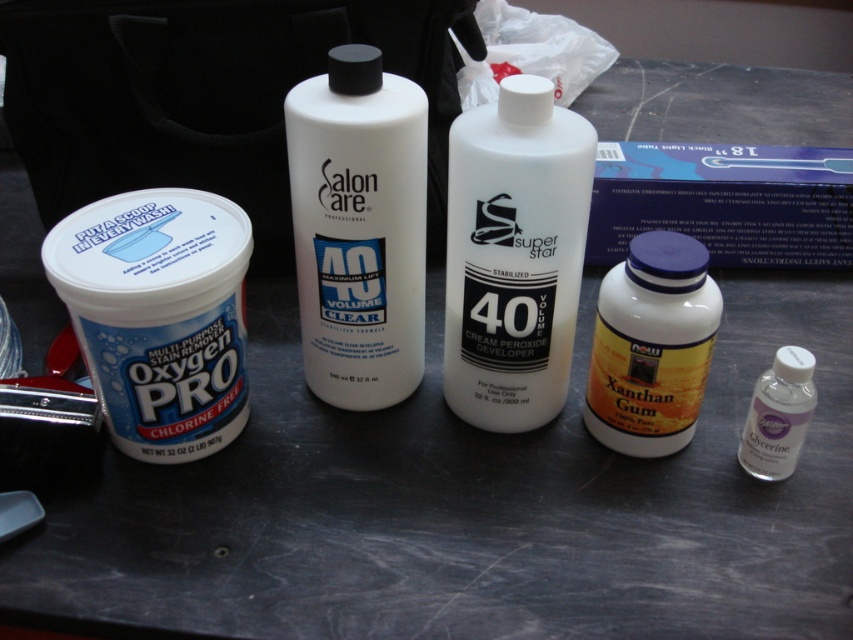
Which is above, white matte container at left or white matte bottle at center?

white matte bottle at center is higher up.

Which is behind, point (167, 378) or point (335, 88)?

Point (167, 378)

The image size is (853, 640). I want to click on white matte container at left, so click(x=160, y=316).

Does white matte bottle at center have a lesser height compared to yellow/golden plastic bottle at center-right?

No, white matte bottle at center is not shorter than yellow/golden plastic bottle at center-right.

Which is in front, point (393, 228) or point (599, 324)?

Point (393, 228) is more forward.

Where is `white matte bottle at center`? white matte bottle at center is located at coordinates (358, 227).

At what (x,y) coordinates should I click in order to perform the action: click on white matte bottle at center. Please return your answer as a coordinate pair (x, y). Looking at the image, I should click on (358, 227).

Who is positioned more to the left, white matte container at left or yellow/golden plastic bottle at center-right?

Positioned to the left is white matte container at left.

Does white matte container at left appear under yellow/golden plastic bottle at center-right?

Incorrect, white matte container at left is not positioned below yellow/golden plastic bottle at center-right.

Is point (102, 372) more distant than point (663, 280)?

Yes, point (102, 372) is farther from viewer.

Find the location of `white matte container at left`. white matte container at left is located at coordinates (160, 316).